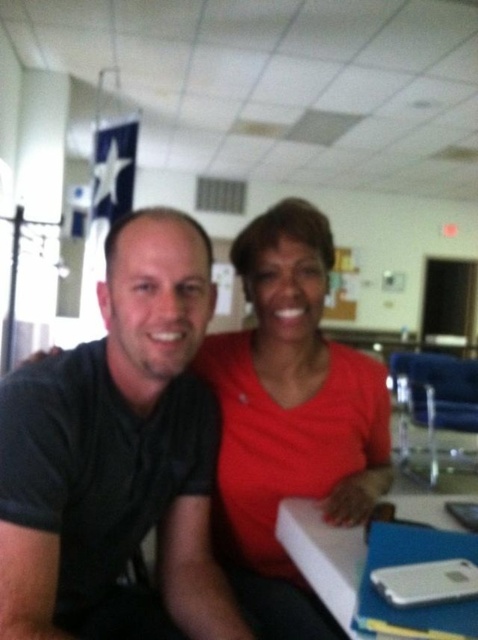
You are an interior designer assessing the layout of this office space. You notice the matte red shirt at center and the white plastic table at lower center. Based on their sizes, which object would appear more prominent to someone entering the room?

The matte red shirt at center appears more prominent because it is larger in size than the white plastic table at lower center.

You are an office assistant who needs to arrange two shirts for a photoshoot. The black matte shirt at center and the matte red shirt at center must be placed on a mannequin. Based on their positions in the current image, which shirt should be placed to the left of the other?

The black matte shirt at center should be placed to the left of the matte red shirt at center because in the current image, the black matte shirt at center is positioned on the left side of the matte red shirt at center.

You are organizing a small event and need to place a 1.2 meter wide banner between the matte red shirt at center and the white plastic table at lower center. Based on their widths, will the banner fit between them?

The matte red shirt at center is wider than the white plastic table at lower center. Since the banner is 1.2 meters wide, it might not fit between them if the distance between the two objects is less than 1.2 meters. However, the description only provides information about their widths, not the distance between them. Therefore, we cannot determine if the banner will fit based solely on the given information.